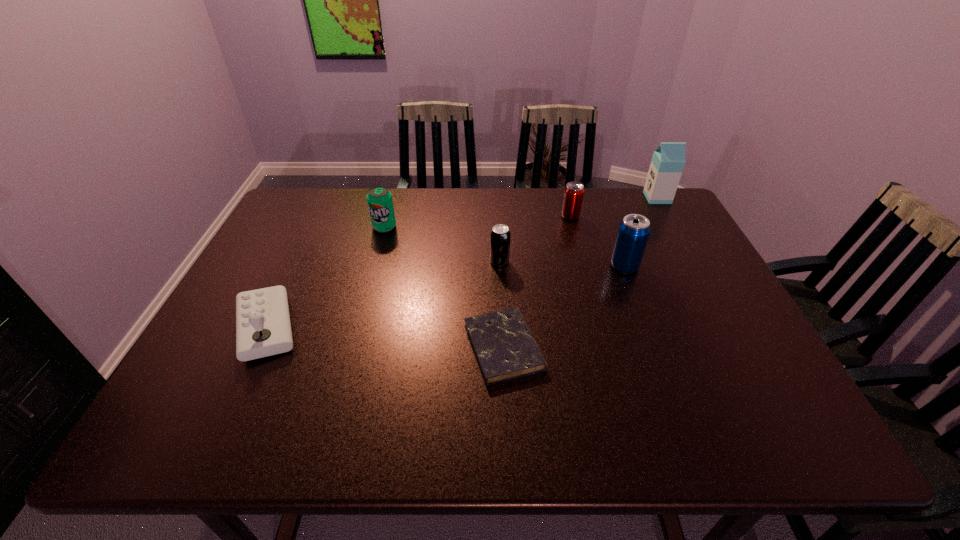
Identify the location of free space located on the front of the sixth shortest object. (633, 288).

I want to click on vacant region located 0.320m on the front-facing side of the leftmost soda can, so click(362, 310).

At what (x,y) coordinates should I click in order to perform the action: click on free location located 0.090m on the front of the fifth object from left to right. Please return your answer as a coordinate pair (x, y). Looking at the image, I should click on (576, 239).

Identify the location of vacant space located 0.380m on the left of the third soda can from right to left. This screenshot has height=540, width=960. (355, 261).

Where is `vacant space situated 0.220m on the right of the joystick`? The height and width of the screenshot is (540, 960). vacant space situated 0.220m on the right of the joystick is located at coordinates (396, 328).

Locate an element on the screen. vacant space located 0.300m on the left of the diary is located at coordinates (333, 347).

Identify the location of milk carton situated at the far edge. This screenshot has height=540, width=960. (668, 161).

You are a GUI agent. You are given a task and a screenshot of the screen. Output one action in this format:
    pyautogui.click(x=<x>, y=<y>)
    Task: Click on the object that is at the left edge
    
    Given the screenshot: What is the action you would take?
    pyautogui.click(x=263, y=328)

The image size is (960, 540). What are the coordinates of `object located in the right edge section of the desktop` in the screenshot? It's located at (668, 161).

You are a GUI agent. You are given a task and a screenshot of the screen. Output one action in this format:
    pyautogui.click(x=<x>, y=<y>)
    Task: Click on the object at the far right corner
    This screenshot has width=960, height=540.
    Given the screenshot: What is the action you would take?
    pyautogui.click(x=668, y=161)